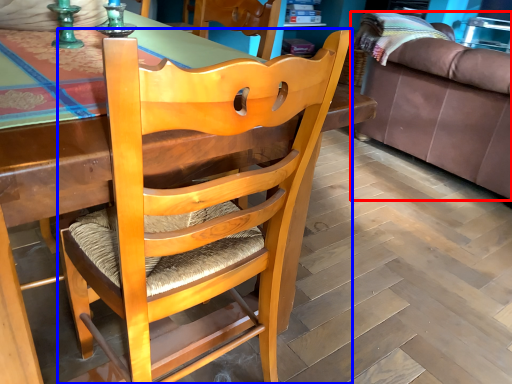
Question: Which object is closer to the camera taking this photo, studio couch (highlighted by a red box) or chair (highlighted by a blue box)?

Choices:
 (A) studio couch
 (B) chair

Answer: (B)